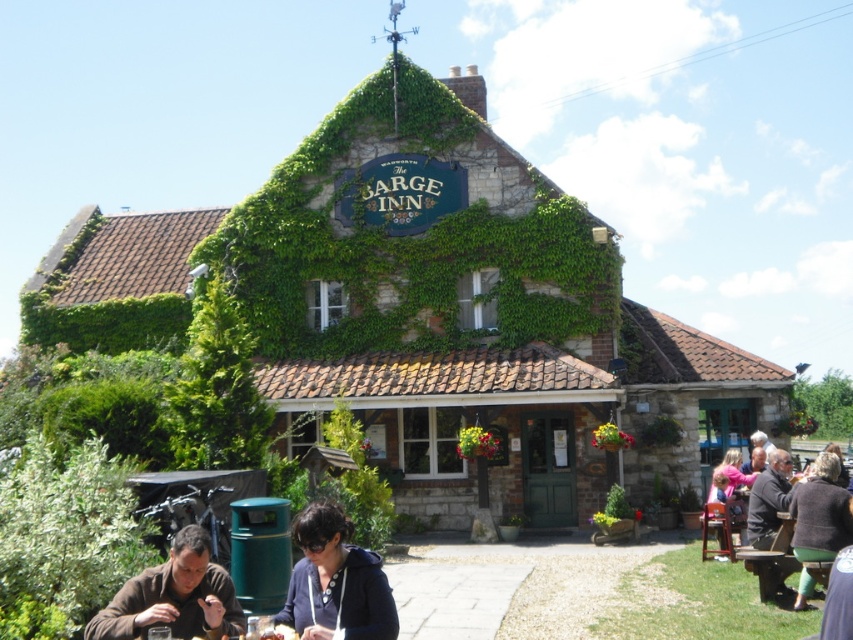
You are standing at the entrance of The BARGE INN and see a dark blue hoodie at center. If you want to pick it up, in which direction should you walk relative to the entrance?

The dark blue hoodie at center is located at point 0.909 on the x axis and 0.394 on the y axis. Since the entrance is at the lower part of the image, the hoodie is positioned to the right and slightly above the entrance. Therefore, you should walk towards the right and slightly forward from the entrance to reach it.

You are a customer entering The BARGE INN and notice two items hanging on the wooden beams above the entrance. Which item is closer to you, the dark blue hoodie at center or the dark brown woolen sweater at lower right?

The dark blue hoodie at center is closer to you because it is positioned under the dark brown woolen sweater at lower right, meaning it is lower in position.

You are a delivery person arriving at The BARGE INN. You see a dark blue hoodie at center and a brown leather jacket at lower left. Which item is taller?

The dark blue hoodie at center is taller than the brown leather jacket at lower left according to the description.